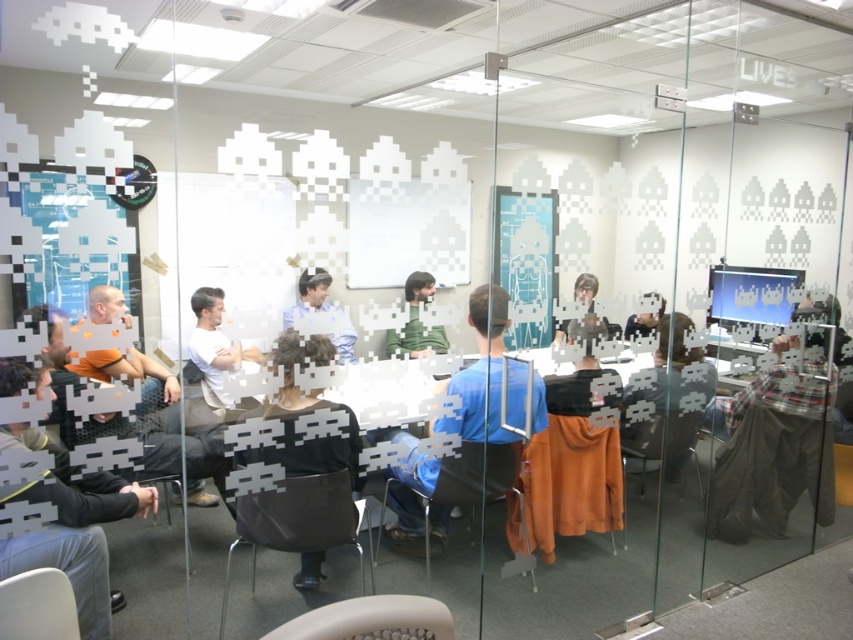
Question: Among these objects, which one is nearest to the camera?

Choices:
 (A) matte black laptop at center
 (B) orange fabric at center
 (C) green matte/soft shirt at center

Answer: (C)

Question: Does black matte jacket at center have a lesser width compared to matte white shirt at center?

Choices:
 (A) no
 (B) yes

Answer: (A)

Question: Does white matte shirt at center come behind green matte/soft shirt at center?

Choices:
 (A) yes
 (B) no

Answer: (B)

Question: Does orange casual shirt at left come behind orange fabric at center?

Choices:
 (A) yes
 (B) no

Answer: (B)

Question: Which object is closer to the camera taking this photo?

Choices:
 (A) orange fabric at center
 (B) matte black laptop at center
 (C) matte white shirt at center

Answer: (C)

Question: Which point appears closest to the camera in this image?

Choices:
 (A) (207, 328)
 (B) (305, 406)

Answer: (A)